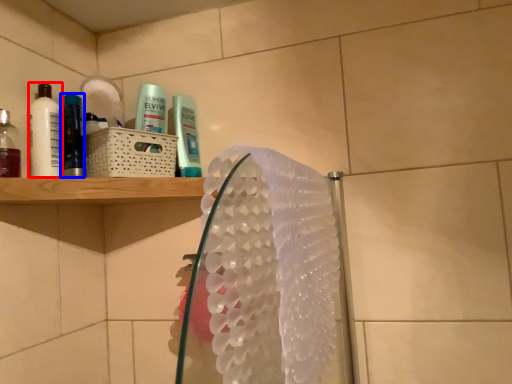
Question: Which of the following is the farthest to the observer, mouthwash (highlighted by a red box) or mouthwash (highlighted by a blue box)?

Choices:
 (A) mouthwash
 (B) mouthwash

Answer: (B)